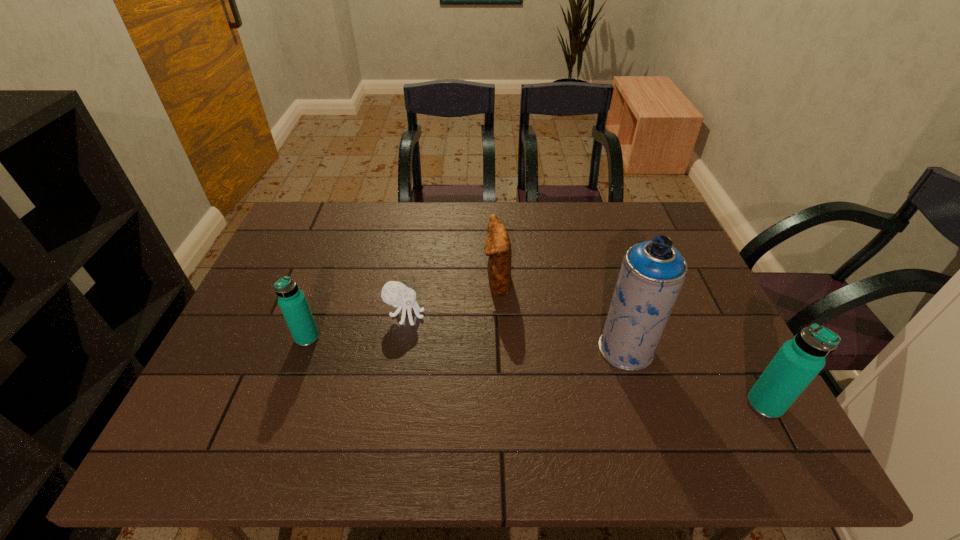
Identify the location of free location that satisfies the following two spatial constraints: 1. on the front-facing side of the second farthest object; 2. on the left side of the aerosol can. [x=399, y=349].

Image resolution: width=960 pixels, height=540 pixels. I want to click on vacant area in the image that satisfies the following two spatial constraints: 1. on the front-facing side of the nearest object; 2. on the right side of the octopus, so click(390, 404).

Find the location of a particular element. This screenshot has height=540, width=960. blank space that satisfies the following two spatial constraints: 1. on the front-facing side of the octopus; 2. on the back side of the aerosol can is located at coordinates (399, 349).